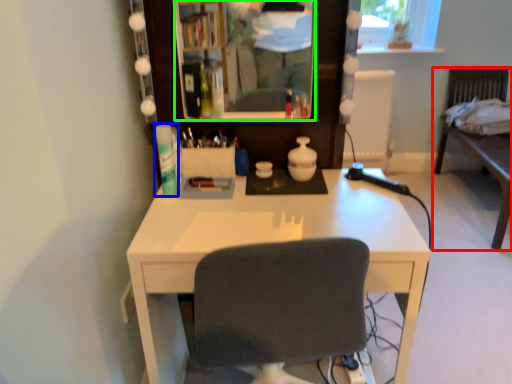
Question: Considering the real-world distances, which object is closest to furniture (highlighted by a red box)? toiletry (highlighted by a blue box) or mirror (highlighted by a green box).

Choices:
 (A) toiletry
 (B) mirror

Answer: (B)